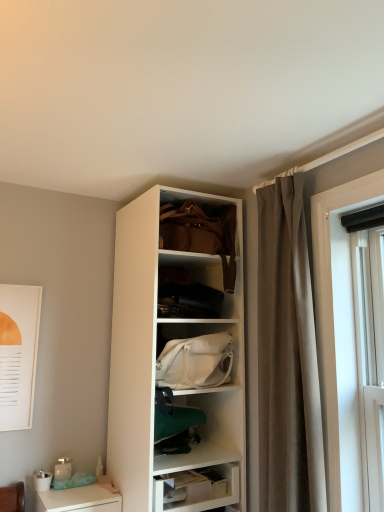
Question: Can you confirm if white fabric handbag at center, the first handbag from the bottom, is positioned to the right of white glossy desk at lower left?

Choices:
 (A) yes
 (B) no

Answer: (A)

Question: Considering the relative positions of white fabric handbag at center, arranged as the 2th handbag when viewed from the top, and white glossy desk at lower left in the image provided, is white fabric handbag at center, arranged as the 2th handbag when viewed from the top, behind white glossy desk at lower left?

Choices:
 (A) no
 (B) yes

Answer: (A)

Question: Is white fabric handbag at center, the first handbag from the bottom, in contact with white glossy desk at lower left?

Choices:
 (A) no
 (B) yes

Answer: (A)

Question: From a real-world perspective, is white fabric handbag at center, the first handbag from the bottom, under white glossy desk at lower left?

Choices:
 (A) no
 (B) yes

Answer: (A)

Question: Considering the relative sizes of white fabric handbag at center, arranged as the 2th handbag when viewed from the top, and white glossy desk at lower left in the image provided, is white fabric handbag at center, arranged as the 2th handbag when viewed from the top, bigger than white glossy desk at lower left?

Choices:
 (A) no
 (B) yes

Answer: (B)

Question: Is brown fabric curtain at right bigger or smaller than white fabric handbag at center, the first handbag from the bottom?

Choices:
 (A) big
 (B) small

Answer: (A)

Question: From the image's perspective, is brown fabric curtain at right located above or below white fabric handbag at center, the first handbag from the bottom?

Choices:
 (A) above
 (B) below

Answer: (A)

Question: From a real-world perspective, is brown fabric curtain at right positioned above or below white fabric handbag at center, arranged as the 2th handbag when viewed from the top?

Choices:
 (A) below
 (B) above

Answer: (B)

Question: Is brown fabric curtain at right to the left or to the right of white fabric handbag at center, arranged as the 2th handbag when viewed from the top, in the image?

Choices:
 (A) right
 (B) left

Answer: (A)

Question: From a real-world perspective, is white fabric handbag at center, arranged as the 2th handbag when viewed from the top, physically located above or below leather handbag at upper center, marked as the 2th handbag in a bottom-to-top arrangement?

Choices:
 (A) above
 (B) below

Answer: (B)

Question: Is white fabric handbag at center, arranged as the 2th handbag when viewed from the top, wider or thinner than leather handbag at upper center, arranged as the first handbag when viewed from the top?

Choices:
 (A) thin
 (B) wide

Answer: (B)

Question: From their relative heights in the image, would you say white fabric handbag at center, the first handbag from the bottom, is taller or shorter than leather handbag at upper center, marked as the 2th handbag in a bottom-to-top arrangement?

Choices:
 (A) short
 (B) tall

Answer: (A)

Question: Is point (165, 371) positioned closer to the camera than point (185, 230)?

Choices:
 (A) farther
 (B) closer

Answer: (B)

Question: In terms of height, does white glossy desk at lower left look taller or shorter compared to leather handbag at upper center, marked as the 2th handbag in a bottom-to-top arrangement?

Choices:
 (A) tall
 (B) short

Answer: (B)

Question: Visually, is white glossy desk at lower left positioned to the left or to the right of leather handbag at upper center, arranged as the first handbag when viewed from the top?

Choices:
 (A) right
 (B) left

Answer: (B)